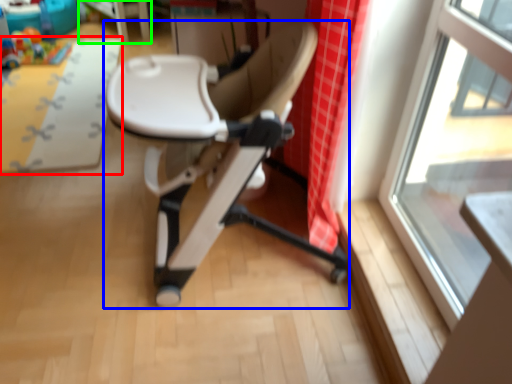
Question: Which is farther away from mat (highlighted by a red box)? chair (highlighted by a blue box) or table (highlighted by a green box)?

Choices:
 (A) chair
 (B) table

Answer: (A)